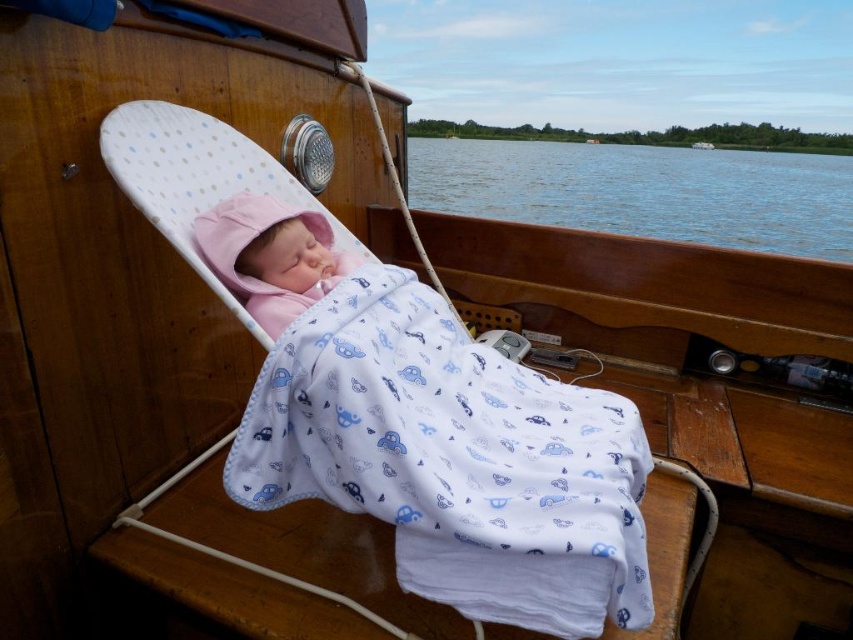
You are on a wooden boat and see the blue water at center and the pink fleece baby at center. Which object is located to the right of the other?

The blue water at center is to the right of the pink fleece baby at center.

You are a photographer standing on the deck of the boat. You want to take a photo of the baby sleeping in the reclining chair. The camera you are holding is 3.65 feet away from the white cotton blanket at center. Can you safely take the photo without moving the camera closer or farther away?

The camera is 3.65 feet away from the white cotton blanket at center, so yes, you can safely take the photo without moving the camera closer or farther away since the distance is appropriate for capturing the scene.